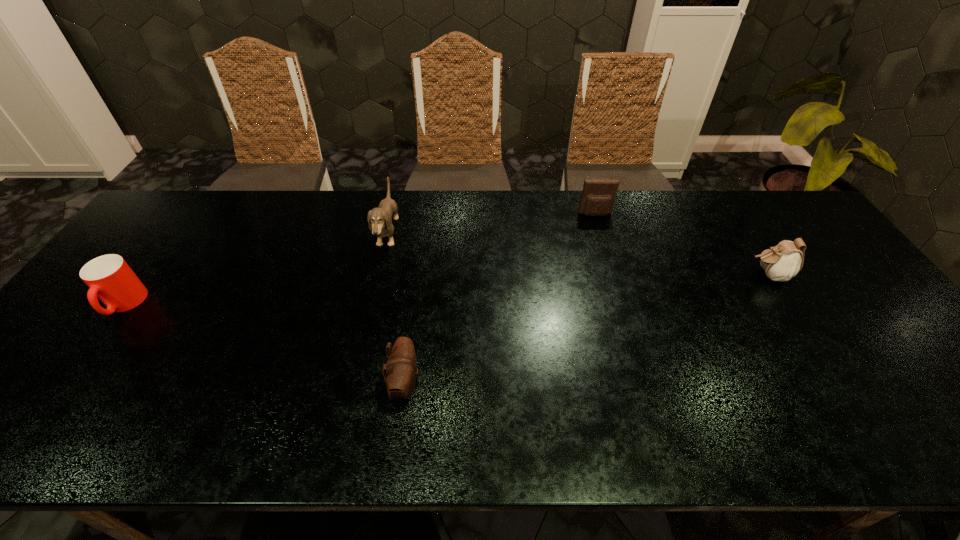
Locate an element on the screen. The image size is (960, 540). vacant space at the near edge of the desktop is located at coordinates (232, 445).

Locate an element on the screen. free region at the left edge is located at coordinates (169, 239).

The image size is (960, 540). What are the coordinates of `vacant area at the right edge` in the screenshot? It's located at (816, 246).

Where is `free location at the near right corner of the desktop`? free location at the near right corner of the desktop is located at coordinates (948, 417).

Image resolution: width=960 pixels, height=540 pixels. I want to click on vacant area that lies between the rightmost object and the leftmost object, so click(446, 290).

Identify the location of free space between the second farthest pouch and the cup. Image resolution: width=960 pixels, height=540 pixels. (446, 290).

You are a GUI agent. You are given a task and a screenshot of the screen. Output one action in this format:
    pyautogui.click(x=<x>, y=<y>)
    Task: Click on the free spot between the second farthest pouch and the fourth object from right to left
    The height and width of the screenshot is (540, 960).
    Given the screenshot: What is the action you would take?
    pyautogui.click(x=578, y=255)

Where is `free space between the rightmost object and the third object from right to left`? free space between the rightmost object and the third object from right to left is located at coordinates (587, 330).

Where is `free area in between the second object from left to right and the second nearest pouch`? The width and height of the screenshot is (960, 540). free area in between the second object from left to right and the second nearest pouch is located at coordinates (578, 255).

Locate an element on the screen. This screenshot has width=960, height=540. free space that is in between the leftmost pouch and the puppy is located at coordinates (396, 309).